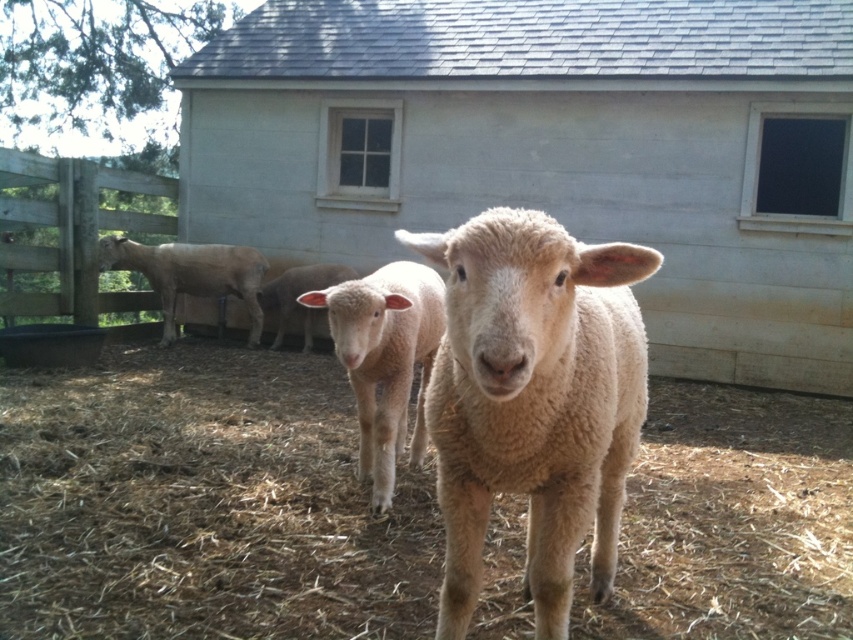
You are a farmer who needs to walk from the wooden gate at left to the white wooden barn at center. Can you estimate if the barn is wider than the gate?

The white wooden barn at center is wider than the wooden gate at left according to the description, so yes, the barn is wider than the gate.

You are standing in the farm scene and want to approach the fuzzy woolen sheep at center. Based on their positions, which direction should you move to reach it?

The fuzzy woolen sheep at center is located at point (532, 401), so you should move towards the center of the image to reach it.

You are a farmer checking the size of your animals and structures. You have a fence that can only accommodate objects up to the width of the light brown woolen sheep at left. Can the white wooden barn at center fit through this fence?

The white wooden barn at center is wider than the light brown woolen sheep at left, so it cannot fit through the fence designed for the sheep.